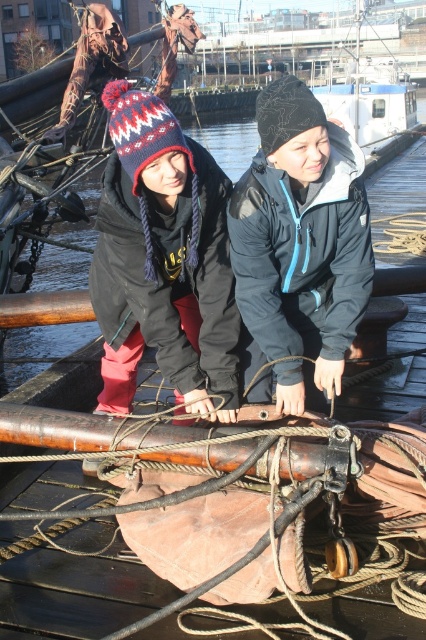
You are a sailor on the deck and need to place a small tool that is 10 cm wide. Which object, the knitted woolen hat at center or the white plastic boat at upper center, would allow the tool to fit beside it without overlapping?

The knitted woolen hat at center has a lesser width compared to white plastic boat at upper center, so the tool can fit beside the knitted woolen hat at center since it is narrower.

You are a sailor on the deck of a ship. You need to retrieve an item from the knitted woolen hat at center and the white plastic boat at upper center. Which object should you reach for first to avoid bending down?

The knitted woolen hat at center is closer to the viewer than the white plastic boat at upper center, so you should reach for the knitted woolen hat at center first to avoid bending down.

In the scene shown: You are a sailor on the deck of a ship. You need to move from the knitted woolen hat at center to the edge of the deck. The deck is 5 meters wide. Can you reach the edge without stepping on any of the scattered ropes?

The knitted woolen hat at center is 3.29 meters away from the edge of the deck. Since the deck is 5 meters wide, there is enough space to move around the scattered ropes and reach the edge safely.